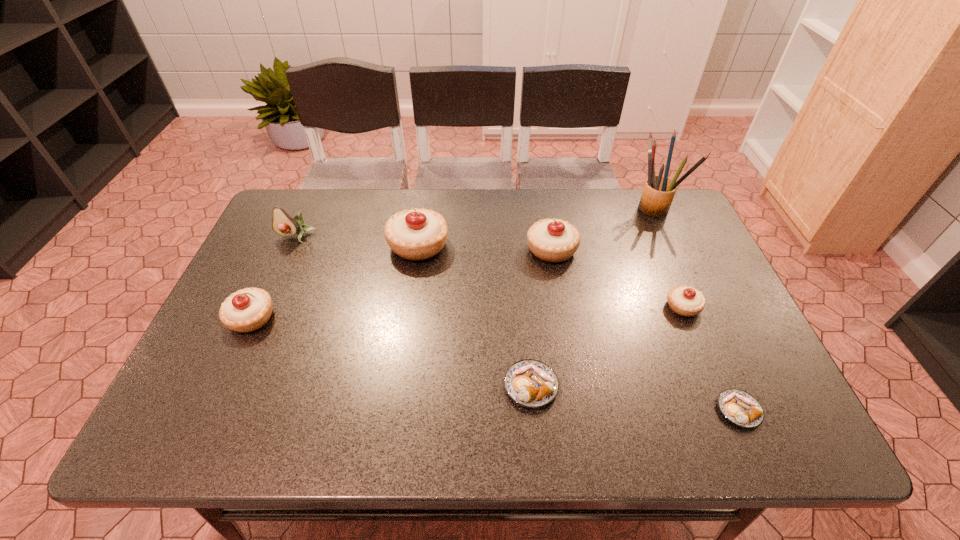
At what (x,y) coordinates should I click in order to perform the action: click on the seventh closest object to the bigger brown pastry. Please return your answer as a coordinate pair (x, y). Looking at the image, I should click on (283, 224).

Locate which object ranks second in proximity to the bigger brown pastry. Please provide its 2D coordinates. Your answer should be formatted as a tuple, i.e. [(x, y)], where the tuple contains the x and y coordinates of a point satisfying the conditions above.

[(687, 301)]

Choose which pastry is the second nearest neighbor to the second beige pastry from left to right. Please provide its 2D coordinates. Your answer should be formatted as a tuple, i.e. [(x, y)], where the tuple contains the x and y coordinates of a point satisfying the conditions above.

[(249, 309)]

At what (x,y) coordinates should I click in order to perform the action: click on pastry that is the closest to the smaller brown pastry. Please return your answer as a coordinate pair (x, y). This screenshot has width=960, height=540. Looking at the image, I should click on (687, 301).

Locate which beige pastry is the closest to the avocado. Please provide its 2D coordinates. Your answer should be formatted as a tuple, i.e. [(x, y)], where the tuple contains the x and y coordinates of a point satisfying the conditions above.

[(249, 309)]

Select which beige pastry is the fourth closest to the avocado. Please provide its 2D coordinates. Your answer should be formatted as a tuple, i.e. [(x, y)], where the tuple contains the x and y coordinates of a point satisfying the conditions above.

[(687, 301)]

Find the location of `free point that satisfies the following two spatial constraints: 1. on the seed side of the third shortest pastry; 2. on the left side of the avocado`. free point that satisfies the following two spatial constraints: 1. on the seed side of the third shortest pastry; 2. on the left side of the avocado is located at coordinates (266, 307).

This screenshot has height=540, width=960. I want to click on vacant space that satisfies the following two spatial constraints: 1. on the seed side of the avocado; 2. on the left side of the third shortest pastry, so click(x=266, y=307).

The image size is (960, 540). In order to click on free point that satisfies the following two spatial constraints: 1. on the seed side of the avocado; 2. on the left side of the smallest beige pastry in this screenshot , I will do `click(266, 307)`.